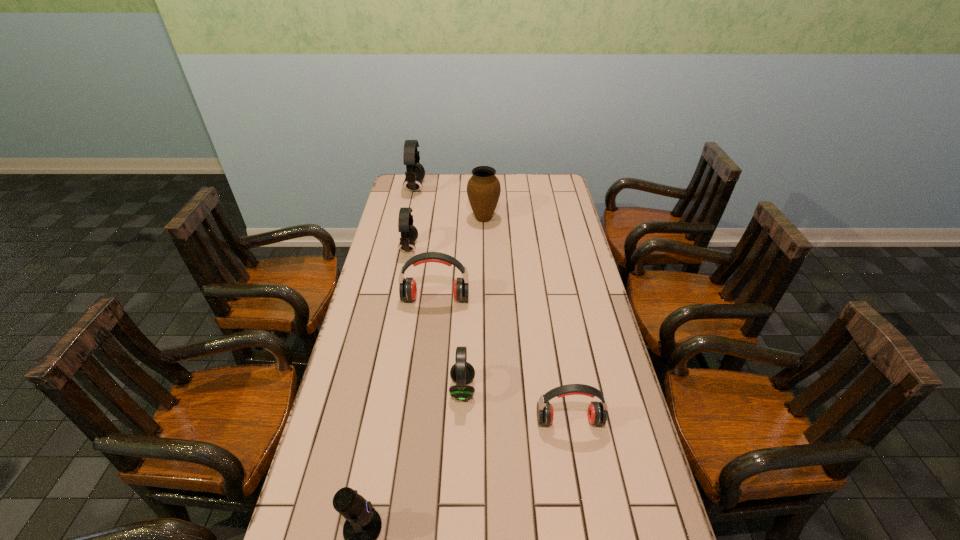
The width and height of the screenshot is (960, 540). What are the coordinates of `earphone identified as the third closest to the rightmost object` in the screenshot? It's located at coord(415,172).

The height and width of the screenshot is (540, 960). Identify the location of the second closest earphone to the fourth nearest object. (597, 415).